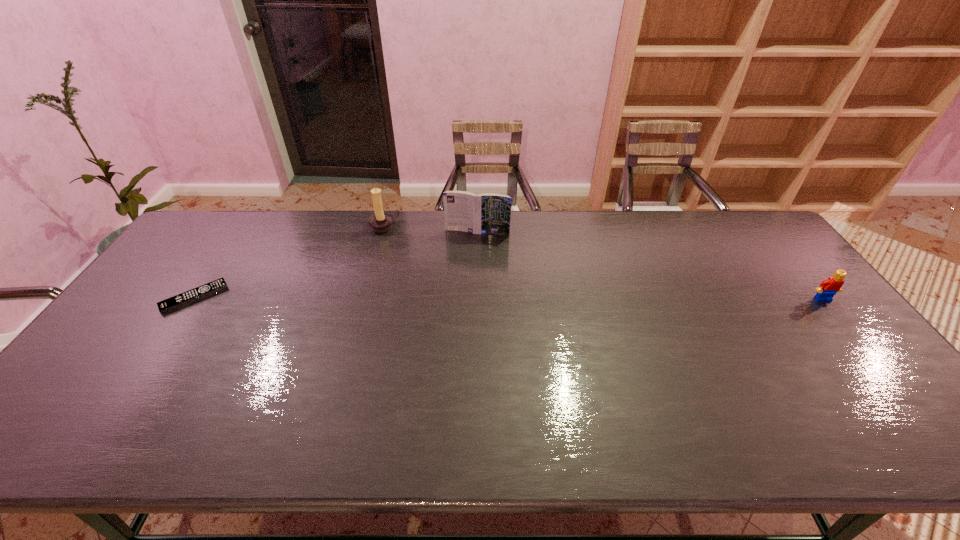
At what (x,y) coordinates should I click in order to perform the action: click on vacant space located on the front cover of the second object from right to left. Please return your answer as a coordinate pair (x, y). The width and height of the screenshot is (960, 540). Looking at the image, I should click on (469, 247).

I want to click on free space located 0.300m on the wick of the second object from left to right, so click(442, 278).

Find the location of a particular element. This screenshot has height=540, width=960. vacant space located 0.340m on the wick of the second object from left to right is located at coordinates (449, 284).

This screenshot has width=960, height=540. Identify the location of vacant space situated on the wick of the second object from left to right. (415, 254).

This screenshot has height=540, width=960. Identify the location of book that is at the far edge. (489, 213).

The image size is (960, 540). I want to click on candle holder located at the far edge, so click(381, 221).

Identify the location of object that is at the left edge. This screenshot has height=540, width=960. (198, 293).

Find the location of a particular element. Image resolution: width=960 pixels, height=540 pixels. object that is at the right edge is located at coordinates (828, 288).

You are a GUI agent. You are given a task and a screenshot of the screen. Output one action in this format:
    pyautogui.click(x=<x>, y=<y>)
    Task: Click on the vacant space at the far edge of the desktop
    
    Given the screenshot: What is the action you would take?
    pyautogui.click(x=280, y=251)

The width and height of the screenshot is (960, 540). In the image, there is a desktop. Identify the location of vacant space at the near edge. 194,386.